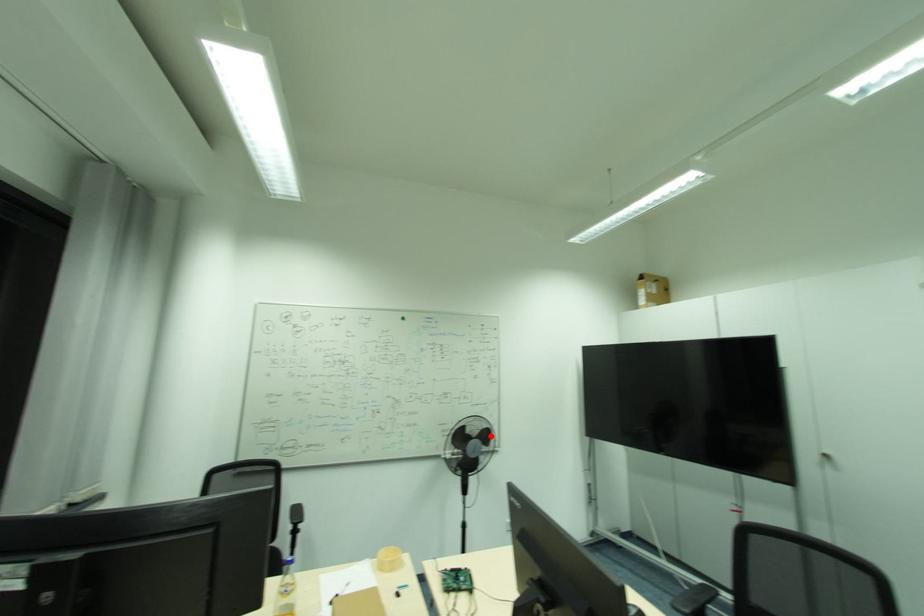
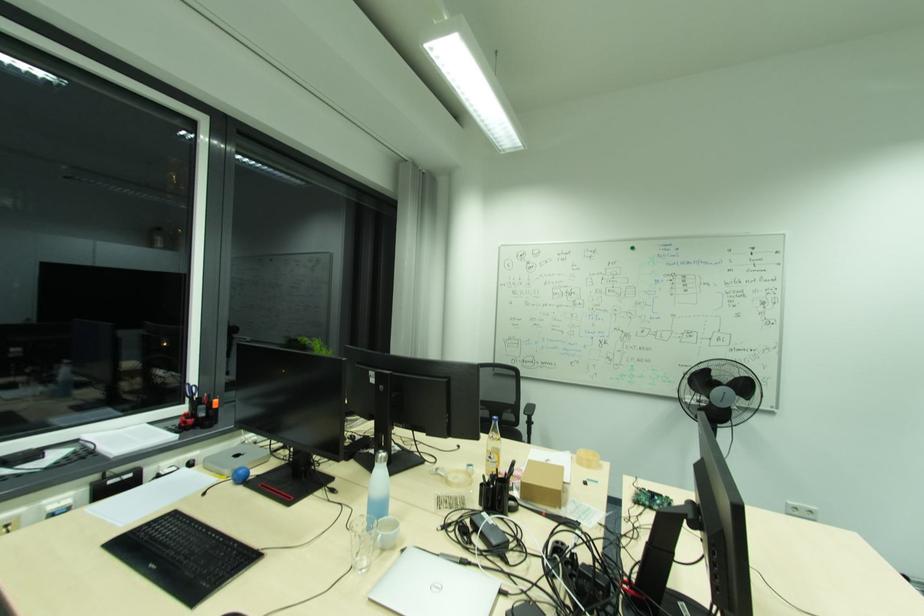
In the second image, find the point that corresponds to the highlighted location in the first image.

(748, 387)